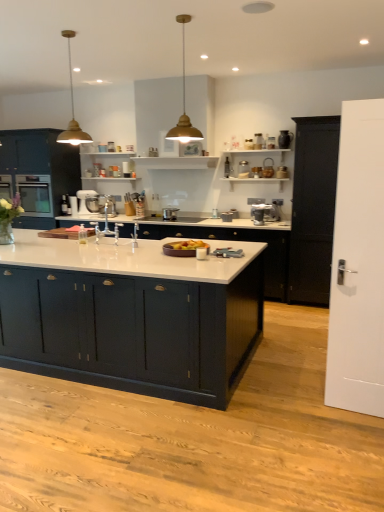
Question: Should I look upward or downward to see metallic silver stand mixer at center, which ranks as the first appliance in left-to-right order?

Choices:
 (A) up
 (B) down

Answer: (A)

Question: Is matte glass jar at upper center, the third appliance positioned from the right, at the left side of matte dark blue cabinet at center, acting as the fourth cabinetry starting from the back?

Choices:
 (A) yes
 (B) no

Answer: (B)

Question: Are matte glass jar at upper center, positioned as the 4th appliance in left-to-right order, and matte dark blue cabinet at center, marked as the 1th cabinetry in a front-to-back arrangement, far apart?

Choices:
 (A) no
 (B) yes

Answer: (B)

Question: Is matte glass jar at upper center, the third appliance positioned from the right, taller than matte dark blue cabinet at center, acting as the fourth cabinetry starting from the back?

Choices:
 (A) no
 (B) yes

Answer: (A)

Question: Considering the relative sizes of matte glass jar at upper center, the third appliance positioned from the right, and matte dark blue cabinet at center, acting as the fourth cabinetry starting from the back, in the image provided, is matte glass jar at upper center, the third appliance positioned from the right, thinner than matte dark blue cabinet at center, acting as the fourth cabinetry starting from the back,?

Choices:
 (A) no
 (B) yes

Answer: (B)

Question: Is matte glass jar at upper center, the third appliance positioned from the right, wider than matte dark blue cabinet at center, marked as the 1th cabinetry in a front-to-back arrangement?

Choices:
 (A) no
 (B) yes

Answer: (A)

Question: From a real-world perspective, does matte glass jar at upper center, the third appliance positioned from the right, stand above matte dark blue cabinet at center, marked as the 1th cabinetry in a front-to-back arrangement?

Choices:
 (A) no
 (B) yes

Answer: (B)

Question: Can matte black kettle at upper right, which is the 6th appliance from left to right, be found inside gold metal pendant light at upper center, acting as the second light fixture starting from the right?

Choices:
 (A) yes
 (B) no

Answer: (B)

Question: From the image's perspective, is gold metal pendant light at upper center, acting as the second light fixture starting from the right, above matte black kettle at upper right, the 1th appliance viewed from the right?

Choices:
 (A) no
 (B) yes

Answer: (A)

Question: Is gold metal pendant light at upper center, acting as the second light fixture starting from the right, closer to camera compared to matte black kettle at upper right, which is the 6th appliance from left to right?

Choices:
 (A) yes
 (B) no

Answer: (A)

Question: Can you confirm if gold metal pendant light at upper center, acting as the second light fixture starting from the right, is thinner than matte black kettle at upper right, which is the 6th appliance from left to right?

Choices:
 (A) yes
 (B) no

Answer: (B)

Question: Considering the relative sizes of gold metal pendant light at upper center, which is the first light fixture from left to right, and matte black kettle at upper right, the 1th appliance viewed from the right, in the image provided, is gold metal pendant light at upper center, which is the first light fixture from left to right, wider than matte black kettle at upper right, the 1th appliance viewed from the right,?

Choices:
 (A) yes
 (B) no

Answer: (A)

Question: Is gold metal pendant light at upper center, acting as the second light fixture starting from the right, at the right side of matte black kettle at upper right, which is the 6th appliance from left to right?

Choices:
 (A) no
 (B) yes

Answer: (A)

Question: Considering the relative positions of satin black oven at left and metallic silver stand mixer at center, which ranks as the first appliance in left-to-right order, in the image provided, is satin black oven at left to the right of metallic silver stand mixer at center, which ranks as the first appliance in left-to-right order, from the viewer's perspective?

Choices:
 (A) no
 (B) yes

Answer: (A)